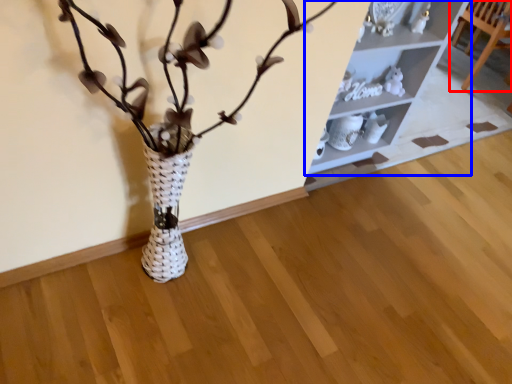
Question: Among these objects, which one is nearest to the camera, furniture (highlighted by a red box) or shelf (highlighted by a blue box)?

Choices:
 (A) furniture
 (B) shelf

Answer: (B)